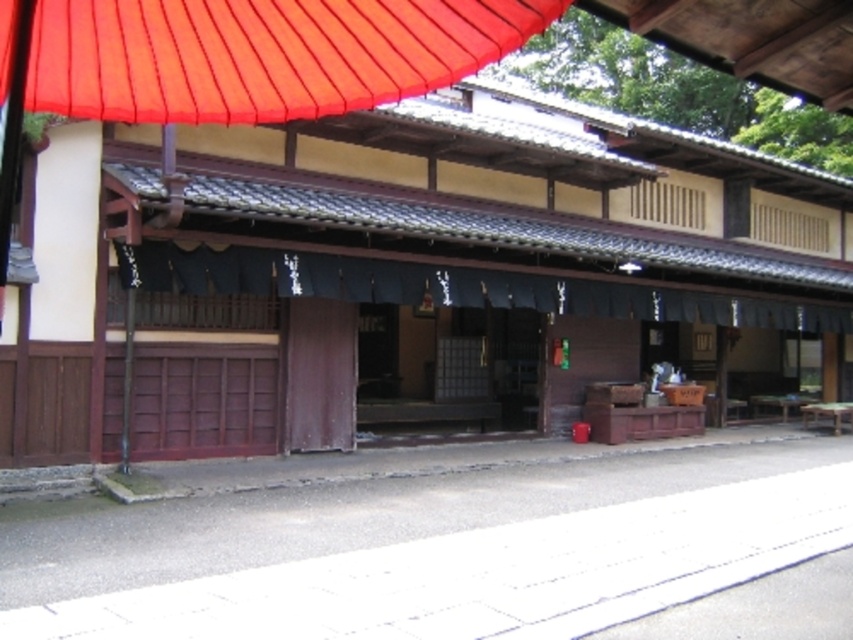
You are standing in front of the traditional Japanese building and want to locate the brown wooden hut at center. According to the coordinates provided, where exactly should you look to find it?

The brown wooden hut at center is located at point (386, 259).

You are a visitor standing in front of the traditional Japanese building. You notice the brown wooden hut at center and the blue fabric curtain at center. Which object is positioned higher relative to the other?

The brown wooden hut at center is located above the blue fabric curtain at center, so it is positioned higher.

You are standing at the point marked as point (386, 259) in the image. What structure are you facing directly?

The point (386, 259) corresponds to the brown wooden hut at center, so you are facing the brown wooden hut at center directly.